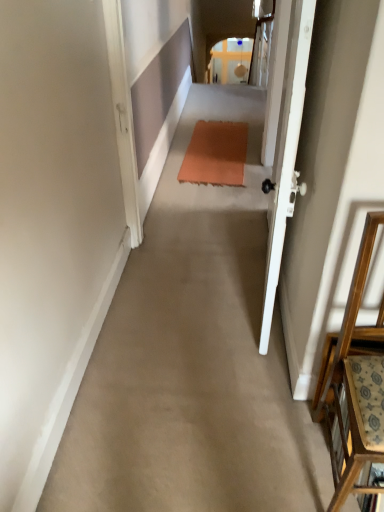
Locate an element on the screen. This screenshot has width=384, height=512. wooden chair at right is located at coordinates (356, 389).

Describe the element at coordinates (356, 389) in the screenshot. I see `wooden chair at right` at that location.

Where is `wooden chair at right`? This screenshot has height=512, width=384. wooden chair at right is located at coordinates 356,389.